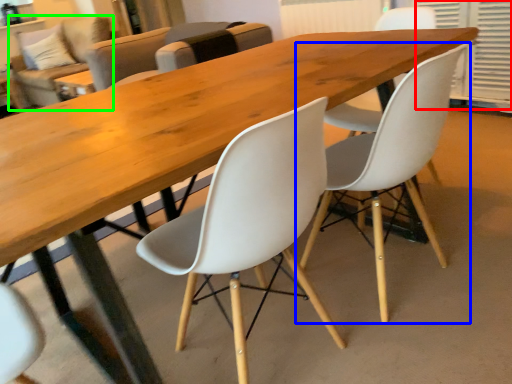
Question: Which object is positioned farthest from shutter (highlighted by a red box)? Select from chair (highlighted by a blue box) and couch (highlighted by a green box).

Choices:
 (A) chair
 (B) couch

Answer: (B)